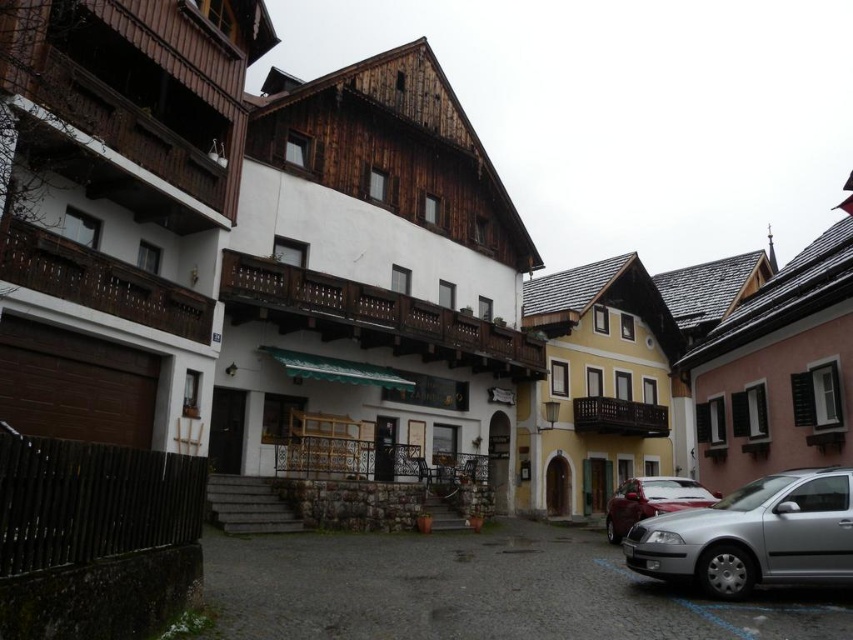
From the picture: Is silver metallic car at lower right taller than shiny red car at lower right?

No.

Does silver metallic car at lower right have a greater width compared to shiny red car at lower right?

Incorrect, silver metallic car at lower right's width does not surpass shiny red car at lower right's.

Between point (795, 476) and point (660, 512), which one is positioned in front?

Point (795, 476) is in front.

Find the location of a particular element. This screenshot has height=640, width=853. silver metallic car at lower right is located at coordinates coord(753,536).